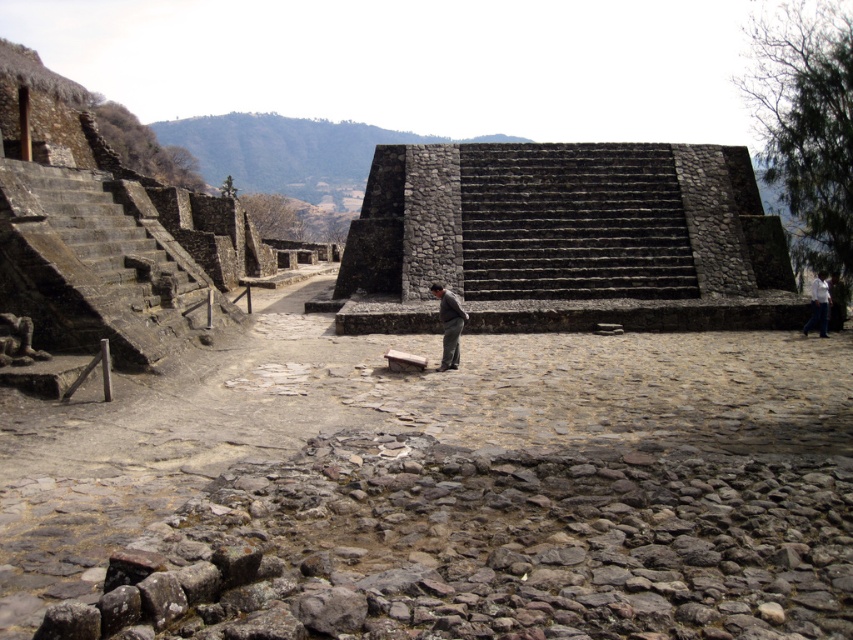
Does dark gray stone pyramid at center appear on the left side of dark gray stone figure at center?

No, dark gray stone pyramid at center is not to the left of dark gray stone figure at center.

Who is more forward, (561, 273) or (451, 349)?

Point (451, 349)

Locate an element on the screen. This screenshot has width=853, height=640. dark gray stone pyramid at center is located at coordinates (566, 237).

Does dark gray stone pyramid at center have a lesser height compared to white cotton shirt at center?

Incorrect, dark gray stone pyramid at center's height does not fall short of white cotton shirt at center's.

Is dark gray stone pyramid at center smaller than white cotton shirt at center?

Actually, dark gray stone pyramid at center might be larger than white cotton shirt at center.

Identify the location of dark gray stone pyramid at center. (566, 237).

Can you confirm if dark gray stone figure at center is taller than white cotton shirt at center?

No, dark gray stone figure at center is not taller than white cotton shirt at center.

Between dark gray stone figure at center and white cotton shirt at center, which one appears on the left side from the viewer's perspective?

Positioned to the left is dark gray stone figure at center.

You are a GUI agent. You are given a task and a screenshot of the screen. Output one action in this format:
    pyautogui.click(x=<x>, y=<y>)
    Task: Click on the dark gray stone figure at center
    The height and width of the screenshot is (640, 853).
    Given the screenshot: What is the action you would take?
    pyautogui.click(x=450, y=324)